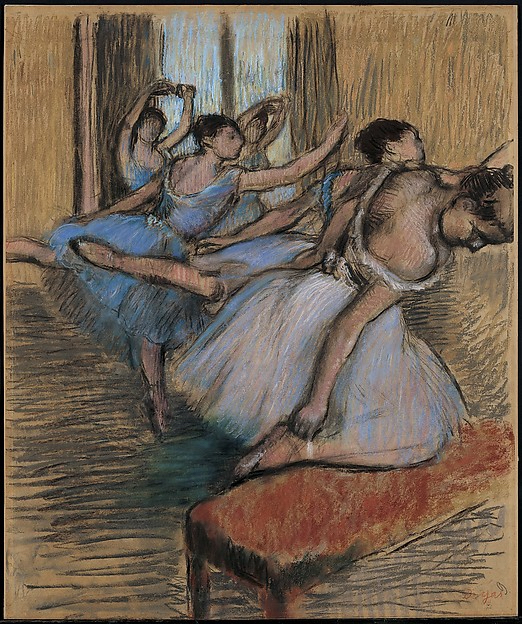
I want to click on chair legs, so click(198, 596), click(277, 613).